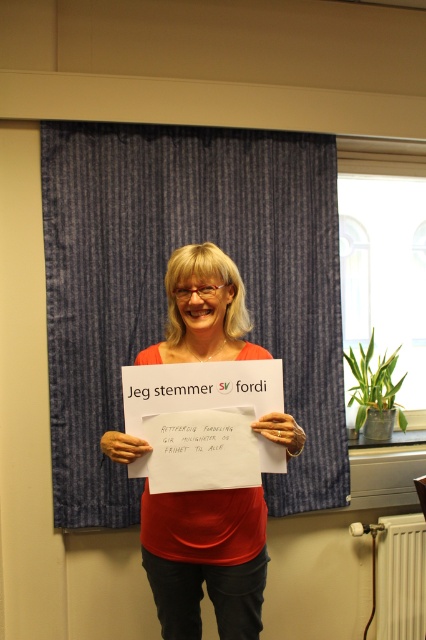
What is the exact location of the blue striped curtain at upper center in the image?

The blue striped curtain at upper center is located at point (x=164, y=291).

Consider the image. You are a photographer trying to capture a clear shot of the matte paper sign at center without any obstructions. Given the blue striped curtain at upper center, can you adjust your position to the right to avoid the curtain blocking the view?

The blue striped curtain at upper center is positioned on the left side of the matte paper sign at center. By moving to the right, you can position yourself so that the curtain is no longer in front of the sign, allowing for an unobstructed view of the matte paper sign at center.

You are a photographer trying to capture a closeup of the woman in the image. You need to focus on the point at coordinates point (250, 134) and point (173, 296). Since you can only focus on one point at a time, which point should you choose to ensure the woman remains in focus?

You should focus on point (173, 296) because it is closer to the viewer than point (250, 134), ensuring the woman stays in focus.